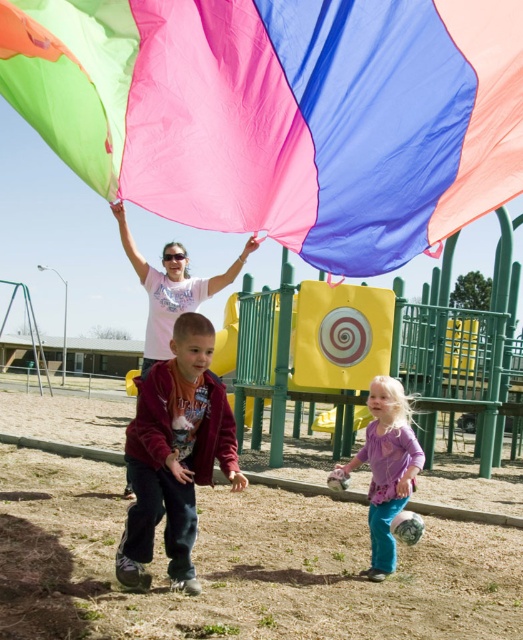
This screenshot has height=640, width=523. What do you see at coordinates (281, 113) in the screenshot? I see `matte nylon flag at upper center` at bounding box center [281, 113].

Can you confirm if matte nylon flag at upper center is positioned below maroon fleece jacket at center?

Incorrect, matte nylon flag at upper center is not positioned below maroon fleece jacket at center.

Which is behind, point (507, 3) or point (176, 422)?

Point (176, 422)

Locate an element on the screen. The width and height of the screenshot is (523, 640). matte nylon flag at upper center is located at coordinates (281, 113).

Is matte nylon flag at upper center to the right of pastel pink fabric at center from the viewer's perspective?

Yes, matte nylon flag at upper center is to the right of pastel pink fabric at center.

Does point (225, 51) come in front of point (253, 246)?

Yes.

The height and width of the screenshot is (640, 523). In order to click on matte nylon flag at upper center in this screenshot , I will do `click(281, 113)`.

Does maroon fleece jacket at center appear under pastel pink fabric at center?

Yes, maroon fleece jacket at center is below pastel pink fabric at center.

Who is more distant from viewer, (142, 403) or (140, 269)?

Point (140, 269)

Where is `maroon fleece jacket at center`? The image size is (523, 640). maroon fleece jacket at center is located at coordinates (176, 454).